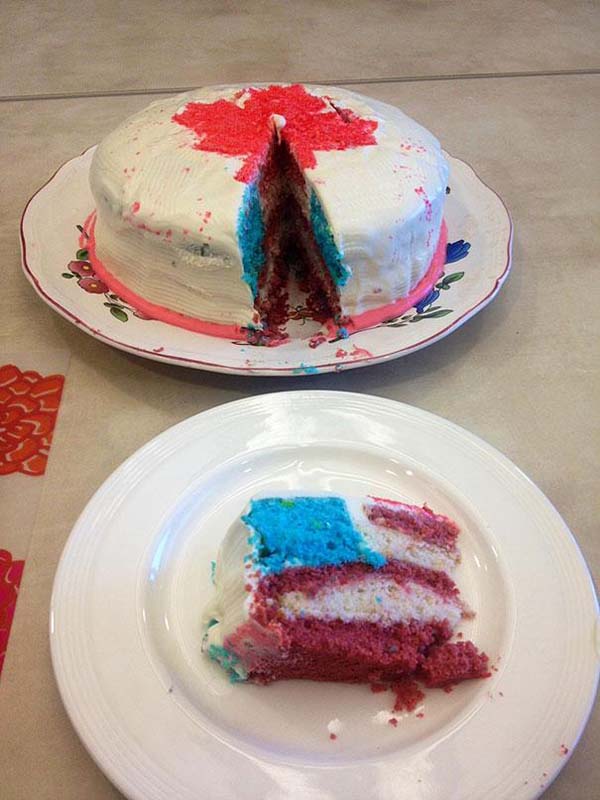
Image resolution: width=600 pixels, height=800 pixels. Find the location of `place mat`. place mat is located at coordinates (32, 394).